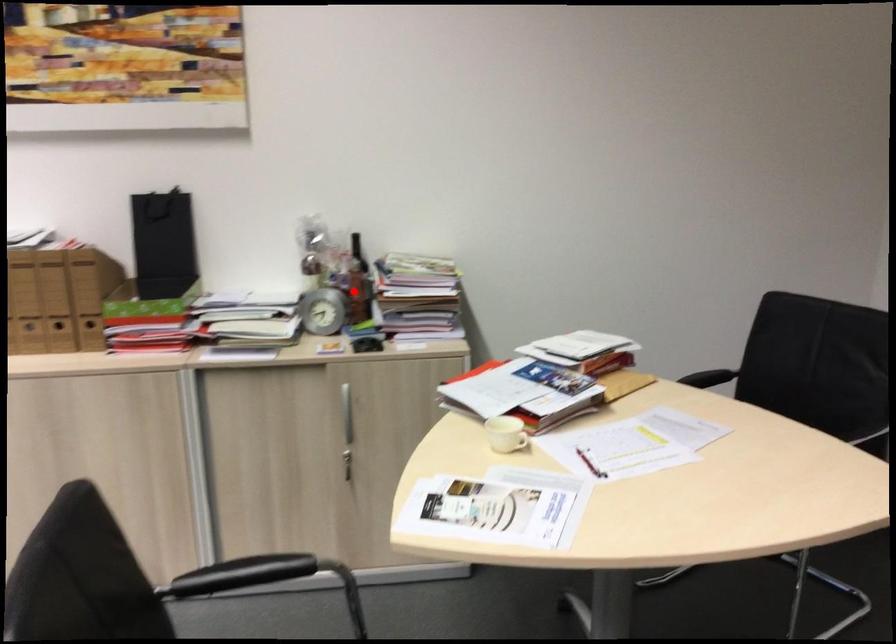
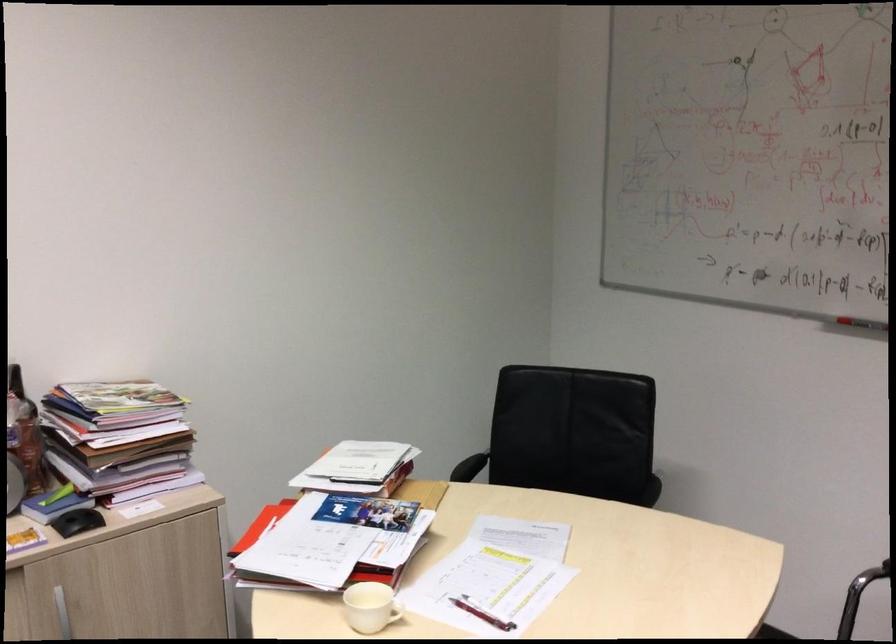
Question: I am providing you with two images of the same scene from different viewpoints. Given a red point in image1, look at the same physical point in image2. Is it:

Choices:
 (A) Closer to the viewpoint
 (B) Farther from the viewpoint

Answer: (A)